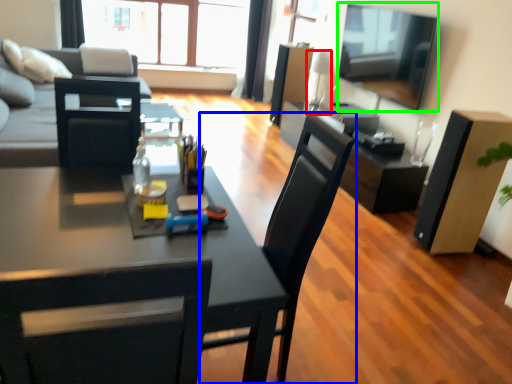
Question: Which object is positioned closest to lamp (highlighted by a red box)? Select from chair (highlighted by a blue box) and television (highlighted by a green box).

Choices:
 (A) chair
 (B) television

Answer: (B)